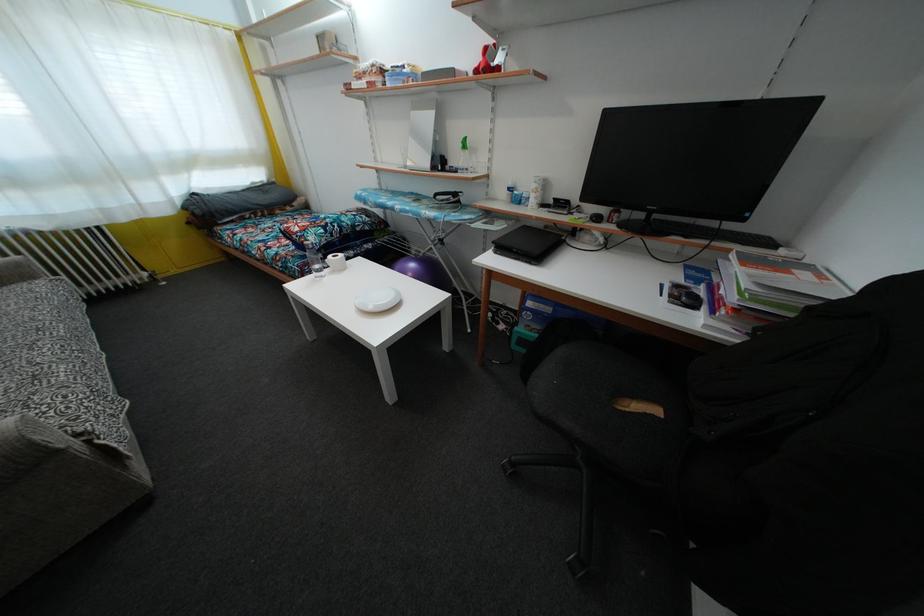
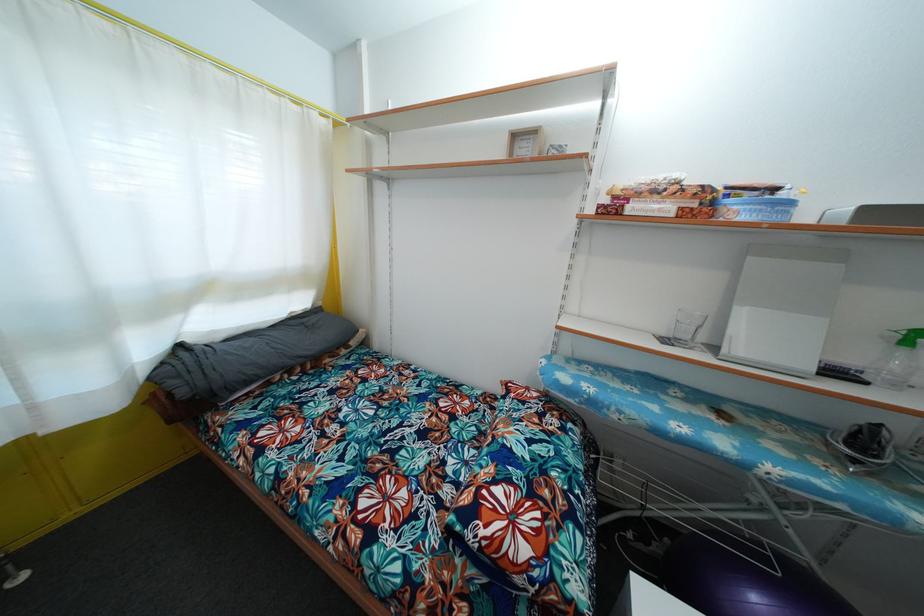
In the second image, find the point that corresponds to pixel 201 219 in the first image.

(187, 399)